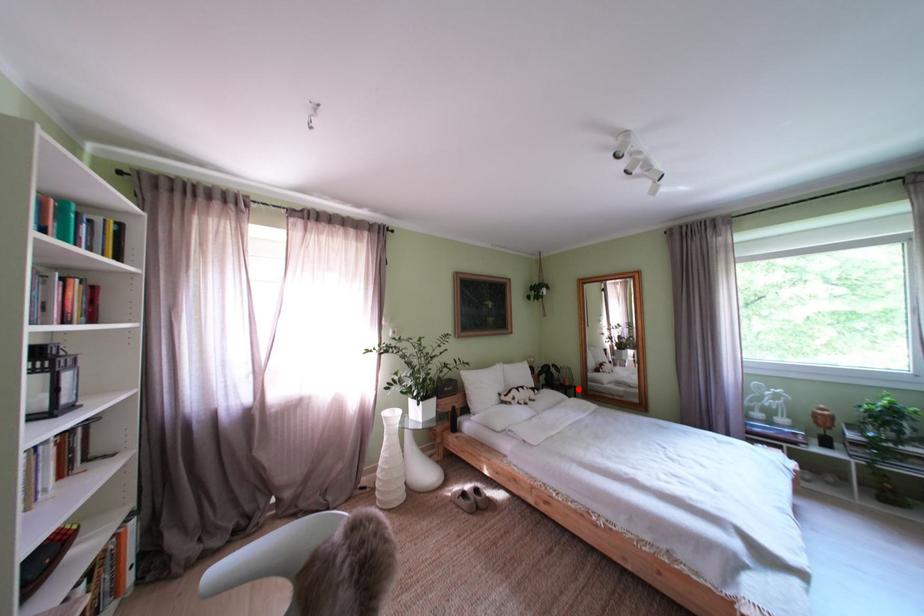
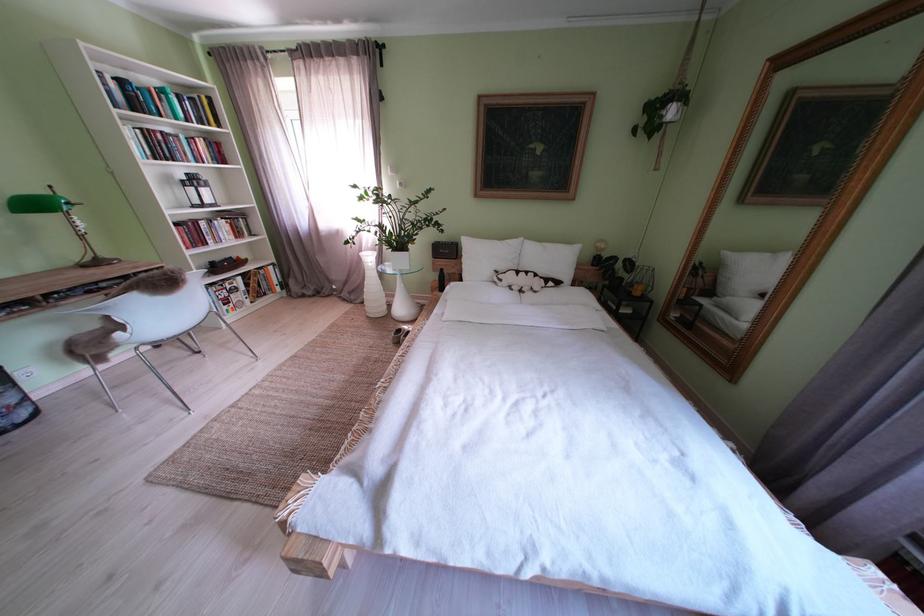
Question: I am providing you with two images of the same scene from different viewpoints. In image1, a red point is highlighted. Considering the same 3D point in image2, which of the following is correct?

Choices:
 (A) It is closer
 (B) It is farther

Answer: (A)